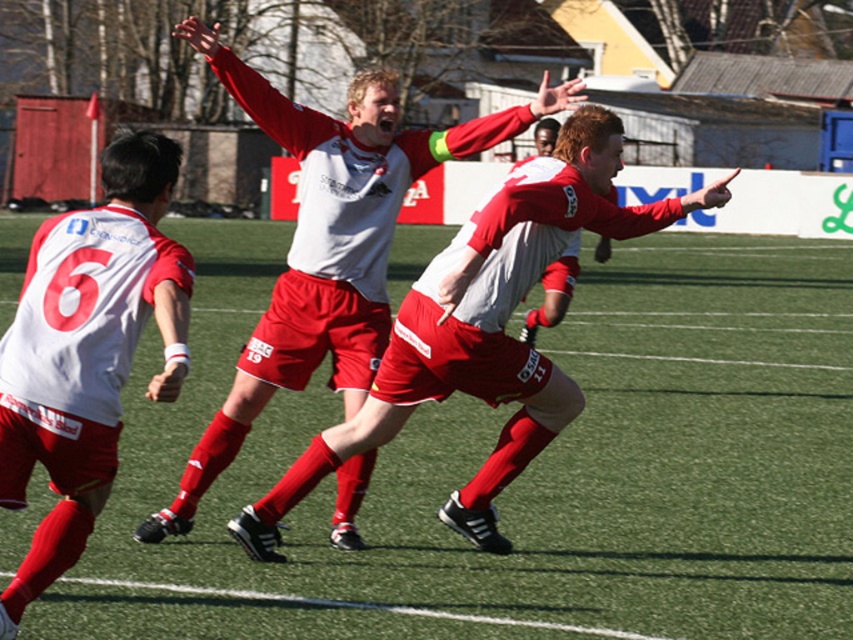
Question: Which point is farther to the camera?

Choices:
 (A) tap(270, 552)
 (B) tap(107, 428)

Answer: (A)

Question: Can you confirm if matte red shorts at center is positioned above white matte jersey at left?

Choices:
 (A) yes
 (B) no

Answer: (A)

Question: Is matte red shorts at center to the left of white matte jersey at left from the viewer's perspective?

Choices:
 (A) yes
 (B) no

Answer: (B)

Question: Where is matte red shorts at center located in relation to white matte jersey at left in the image?

Choices:
 (A) right
 (B) left

Answer: (A)

Question: Which point is farther from the camera taking this photo?

Choices:
 (A) (498, 456)
 (B) (61, 368)

Answer: (A)

Question: Which point is closer to the camera taking this photo?

Choices:
 (A) (56, 296)
 (B) (587, 202)

Answer: (A)